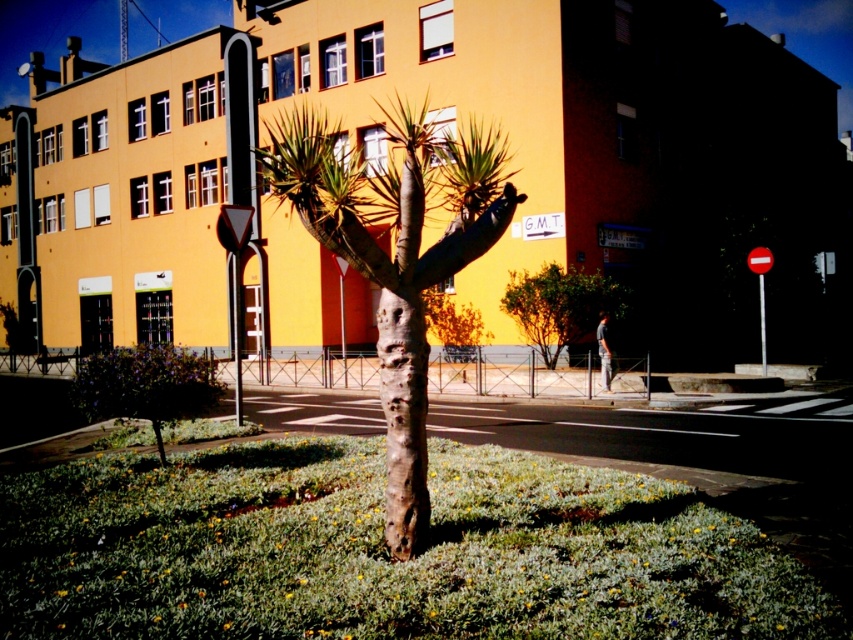
You are standing on the pedestrian crossing in front of the yellow building. You see two points marked on the ground. One is at point (192, 369) and the other is at point (762, 266). Which point is closer to you?

Point (192, 369) is in front of point (762, 266), so it is closer to you.

You are a pedestrian standing on the sidewalk near the pedestrian crossing. You see the green leafy bush at center and the red plastic sign at right. Which object is closer to the ground?

The green leafy bush at center is closer to the ground because it is positioned below the red plastic sign at right.

Based on the photo, you are a delivery person trying to avoid hitting the green matte tree at lower left and the red plastic sign at right with your cart. Which object is taller and requires more caution when navigating around it?

The green matte tree at lower left is much taller than the red plastic sign at right, so you need to be more cautious around the green matte tree at lower left to avoid hitting it.